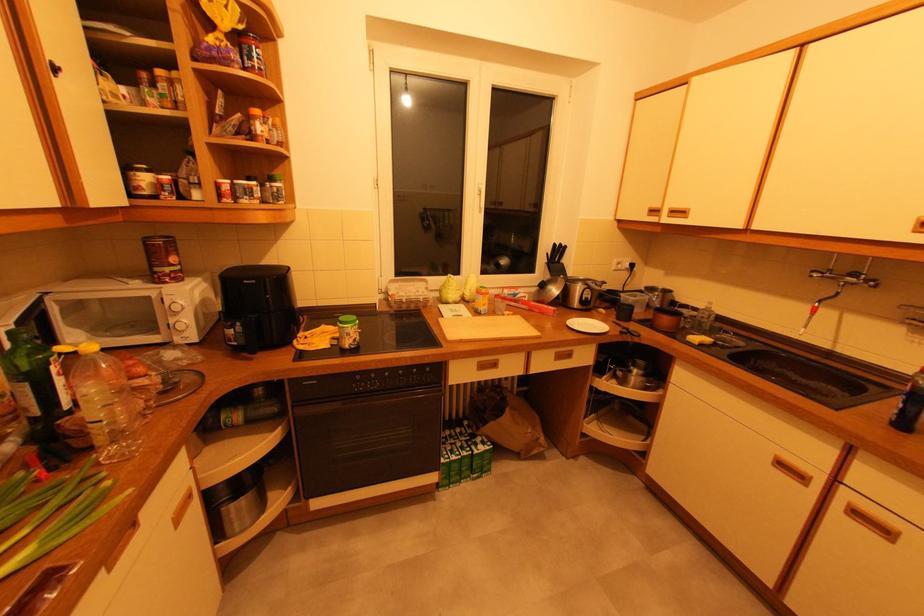
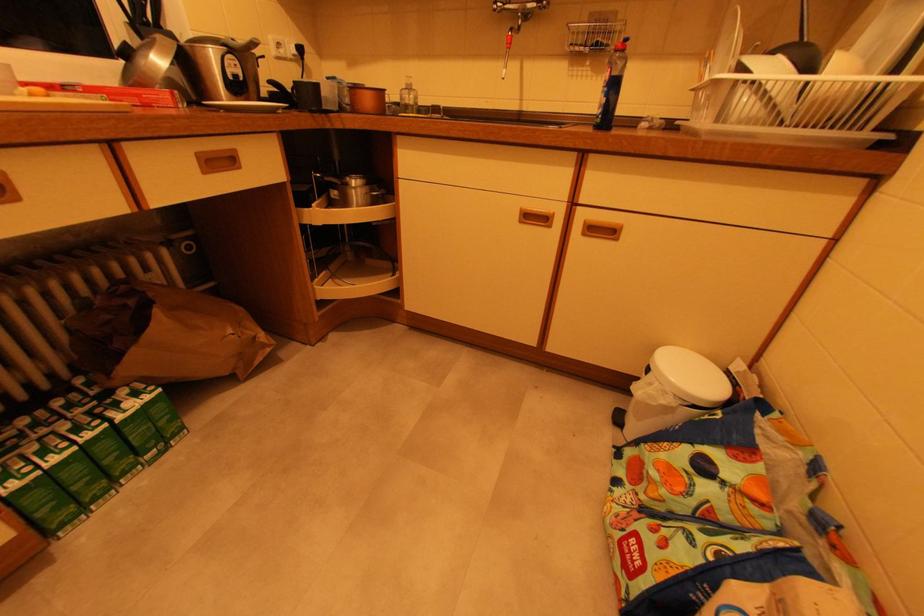
Where in the second image is the point corresponding to pixel 466 429 from the first image?

(78, 395)